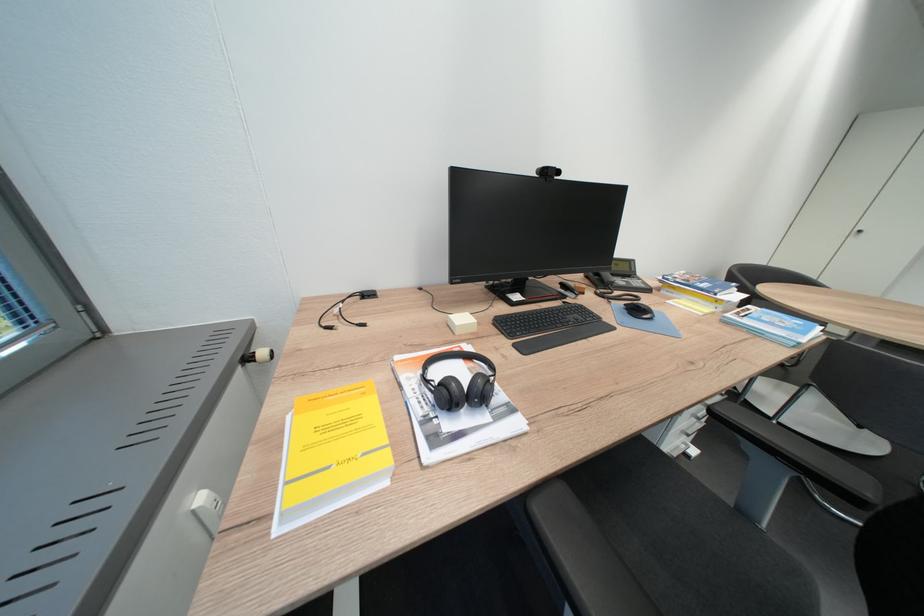
Identify the location of black computer mouse. The image size is (924, 616). (638, 310).